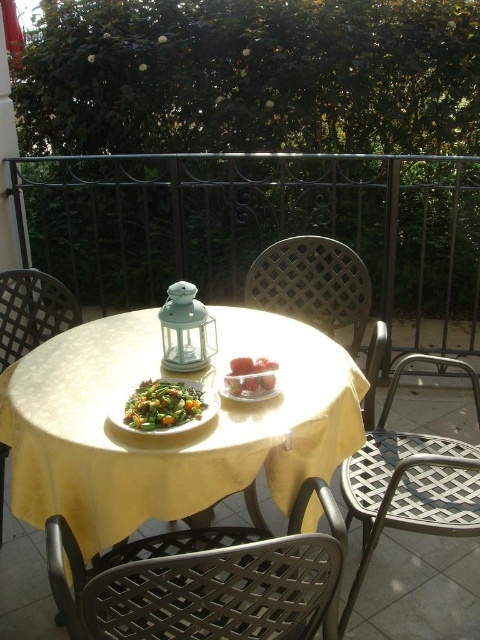
You are planning to place a small vase between the yellow fabric table at center and the smooth glass bowl at center. The vase is 15 centimeters wide. Is there enough space between them to fit the vase?

The yellow fabric table at center is 28.82 centimeters away from the smooth glass bowl at center. Since the vase is only 15 centimeters wide, there is sufficient space between them to place the vase.

You are planning to seat two guests at the table. Considering the metallic lattice chair at lower right and the metallic lattice chair at center, which chair would be more comfortable for taller guests?

The metallic lattice chair at lower right would be more comfortable for taller guests since it has a larger size compared to the metallic lattice chair at center.

You are a person with a 30 inch wide sofa. You want to place it between the metallic lattice chair at lower right and metallic lattice chair at center. Is there enough space?

The distance between the metallic lattice chair at lower right and metallic lattice chair at center is 13.17 inches, which is less than the 30 inch width of the sofa. Therefore, there is not enough space to place the sofa between them.